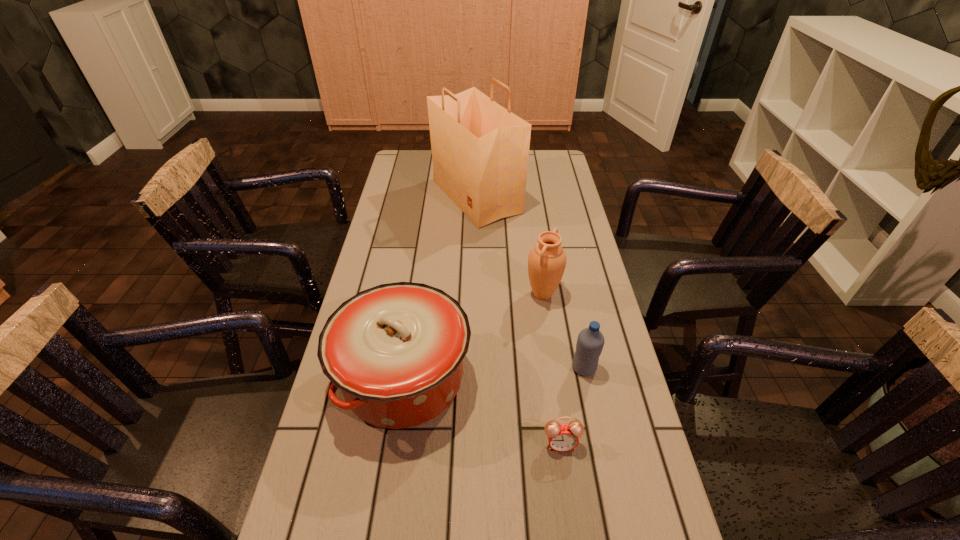
Identify the location of vacant area located 0.160m on the clock face of the alarm clock. (573, 534).

Image resolution: width=960 pixels, height=540 pixels. Identify the location of object that is at the far edge. (480, 150).

Where is `object that is at the left edge`? This screenshot has width=960, height=540. object that is at the left edge is located at coordinates (396, 351).

Where is `urn located in the right edge section of the desktop`? The height and width of the screenshot is (540, 960). urn located in the right edge section of the desktop is located at coordinates (547, 260).

This screenshot has height=540, width=960. Identify the location of water bottle located in the right edge section of the desktop. (590, 342).

The width and height of the screenshot is (960, 540). Identify the location of alarm clock located at the right edge. (562, 437).

Locate an element on the screen. This screenshot has height=540, width=960. vacant space at the left edge is located at coordinates (388, 260).

Where is `free space at the right edge of the desktop`? The height and width of the screenshot is (540, 960). free space at the right edge of the desktop is located at coordinates (534, 182).

Where is `blank space at the far left corner`? The height and width of the screenshot is (540, 960). blank space at the far left corner is located at coordinates (405, 151).

The height and width of the screenshot is (540, 960). Identify the location of vacant region between the shortest object and the second farthest object. tap(552, 369).